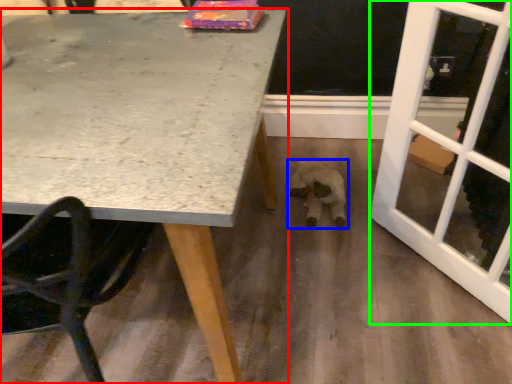
Question: Which object is the farthest from table (highlighted by a red box)? Choose among these: animal (highlighted by a blue box) or screen door (highlighted by a green box).

Choices:
 (A) animal
 (B) screen door

Answer: (A)